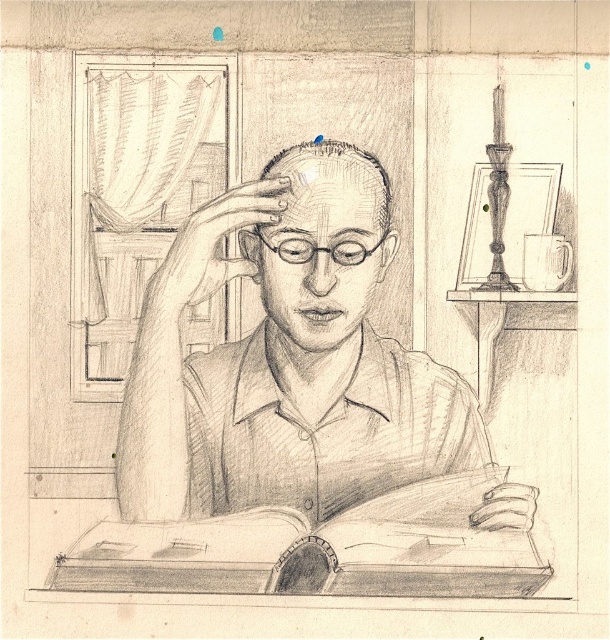
The height and width of the screenshot is (640, 610). What do you see at coordinates (325, 241) in the screenshot?
I see `smooth skin head at center` at bounding box center [325, 241].

Does smooth skin head at center appear under white ceramic mug at upper right?

No.

Is point (307, 161) closer to camera compared to point (525, 268)?

Yes, point (307, 161) is closer to viewer.

I want to click on smooth skin head at center, so click(x=325, y=241).

Is point (334, 397) positioned after point (337, 236)?

Yes, point (334, 397) is farther from viewer.

Is pencil-drawn man at center above smooth skin head at center?

No, pencil-drawn man at center is not above smooth skin head at center.

Between point (392, 339) and point (339, 179), which one is positioned in front?

Positioned in front is point (339, 179).

Where is `pencil-drawn man at center`? The image size is (610, 640). pencil-drawn man at center is located at coordinates (285, 358).

Can you confirm if smooth paper book at center is positioned below smooth skin head at center?

Indeed, smooth paper book at center is positioned under smooth skin head at center.

Which is below, smooth paper book at center or smooth skin head at center?

smooth paper book at center

Which is in front, point (228, 536) or point (310, 344)?

Point (228, 536) is in front.

This screenshot has height=640, width=610. What are the coordinates of `smooth paper book at center` in the screenshot? It's located at (318, 548).